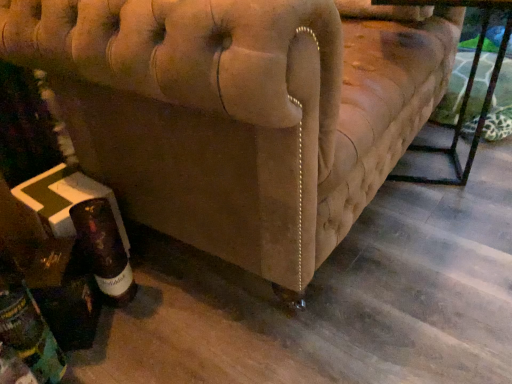
Question: Is brown glass bottle at lower left, which appears as the second bottle when viewed from the left, taller or shorter than beige fabric couch at lower left?

Choices:
 (A) short
 (B) tall

Answer: (A)

Question: Would you say brown glass bottle at lower left, placed as the 1th bottle when sorted from right to left, is inside or outside beige fabric couch at lower left?

Choices:
 (A) inside
 (B) outside

Answer: (B)

Question: Estimate the real-world distances between objects in this image. Which object is farther from the dark brown glass bottle at lower left, which is the second bottle from right to left?

Choices:
 (A) brown glass bottle at lower left, which appears as the second bottle when viewed from the left
 (B) metallic black table at lower right
 (C) beige fabric couch at lower left

Answer: (B)

Question: Which is nearer to the metallic black table at lower right?

Choices:
 (A) beige fabric couch at lower left
 (B) dark brown glass bottle at lower left, which is the second bottle from right to left
 (C) brown glass bottle at lower left, placed as the 1th bottle when sorted from right to left

Answer: (A)